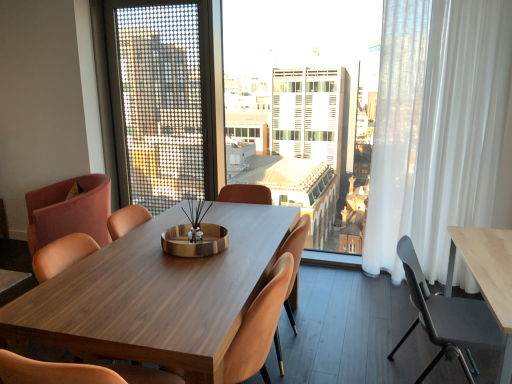
Question: From the image's perspective, is white sheer curtain at right above metallic mesh screen door at upper center?

Choices:
 (A) yes
 (B) no

Answer: (B)

Question: Is metallic mesh screen door at upper center located within white sheer curtain at right?

Choices:
 (A) no
 (B) yes

Answer: (A)

Question: Is white sheer curtain at right outside metallic mesh screen door at upper center?

Choices:
 (A) yes
 (B) no

Answer: (A)

Question: From a real-world perspective, is white sheer curtain at right located higher than metallic mesh screen door at upper center?

Choices:
 (A) no
 (B) yes

Answer: (A)

Question: Is white sheer curtain at right oriented away from metallic mesh screen door at upper center?

Choices:
 (A) yes
 (B) no

Answer: (B)

Question: Can you confirm if white sheer curtain at right is smaller than metallic mesh screen door at upper center?

Choices:
 (A) yes
 (B) no

Answer: (B)

Question: Can you confirm if pink fabric chair at left, the 1th chair positioned from the left, is wider than metallic gray chair at right, which is the fifth chair in left-to-right order?

Choices:
 (A) yes
 (B) no

Answer: (A)

Question: From the image's perspective, would you say pink fabric chair at left, the 1th chair positioned from the left, is shown under metallic gray chair at right, which is the fifth chair in left-to-right order?

Choices:
 (A) no
 (B) yes

Answer: (A)

Question: From a real-world perspective, is pink fabric chair at left, positioned as the fifth chair in right-to-left order, on metallic gray chair at right, acting as the first chair starting from the right?

Choices:
 (A) no
 (B) yes

Answer: (B)

Question: Is pink fabric chair at left, positioned as the fifth chair in right-to-left order, facing towards metallic gray chair at right, acting as the first chair starting from the right?

Choices:
 (A) yes
 (B) no

Answer: (B)

Question: Would you say pink fabric chair at left, positioned as the fifth chair in right-to-left order, is outside metallic gray chair at right, which is the fifth chair in left-to-right order?

Choices:
 (A) no
 (B) yes

Answer: (B)

Question: Does pink fabric chair at left, positioned as the fifth chair in right-to-left order, have a lesser height compared to metallic gray chair at right, which is the fifth chair in left-to-right order?

Choices:
 (A) no
 (B) yes

Answer: (A)

Question: Is pink fabric chair at left, positioned as the fifth chair in right-to-left order, positioned far away from wooden chair at center, which is the 4th chair from right to left?

Choices:
 (A) no
 (B) yes

Answer: (B)